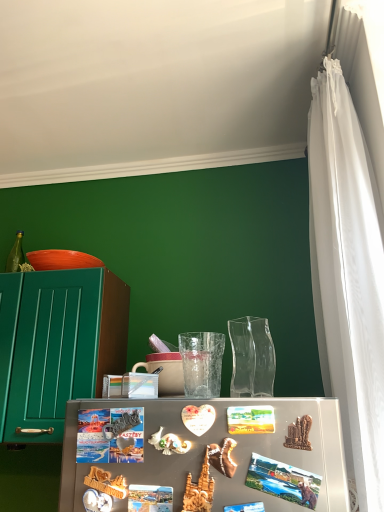
Question: From the image's perspective, would you say matte ceramic mug at center is shown under transparent glass vase at center?

Choices:
 (A) yes
 (B) no

Answer: (A)

Question: Is transparent glass vase at center inside matte ceramic mug at center?

Choices:
 (A) yes
 (B) no

Answer: (B)

Question: Can you confirm if matte ceramic mug at center is taller than transparent glass vase at center?

Choices:
 (A) yes
 (B) no

Answer: (A)

Question: Considering the relative sizes of matte ceramic mug at center and transparent glass vase at center in the image provided, is matte ceramic mug at center bigger than transparent glass vase at center?

Choices:
 (A) yes
 (B) no

Answer: (A)

Question: Is matte ceramic mug at center far away from transparent glass vase at center?

Choices:
 (A) no
 (B) yes

Answer: (A)

Question: Is transparent glass vase at center in front of or behind orange matte bowl at upper left in the image?

Choices:
 (A) front
 (B) behind

Answer: (A)

Question: Does point (266, 361) appear closer or farther from the camera than point (57, 258)?

Choices:
 (A) closer
 (B) farther

Answer: (A)

Question: From a real-world perspective, is transparent glass vase at center physically located above or below orange matte bowl at upper left?

Choices:
 (A) above
 (B) below

Answer: (B)

Question: Considering the relative positions of transparent glass vase at center and orange matte bowl at upper left in the image provided, is transparent glass vase at center to the left or to the right of orange matte bowl at upper left?

Choices:
 (A) left
 (B) right

Answer: (B)

Question: Is orange matte bowl at upper left spatially inside transparent textured glass at center, or outside of it?

Choices:
 (A) outside
 (B) inside

Answer: (A)

Question: Is orange matte bowl at upper left wider or thinner than transparent textured glass at center?

Choices:
 (A) thin
 (B) wide

Answer: (B)

Question: Is orange matte bowl at upper left in front of or behind transparent textured glass at center in the image?

Choices:
 (A) behind
 (B) front

Answer: (A)

Question: Considering the positions of orange matte bowl at upper left and transparent textured glass at center in the image, is orange matte bowl at upper left taller or shorter than transparent textured glass at center?

Choices:
 (A) short
 (B) tall

Answer: (A)

Question: Is point (299, 480) positioned closer to the camera than point (168, 382)?

Choices:
 (A) farther
 (B) closer

Answer: (B)

Question: In terms of height, does metallic photo magnet at center look taller or shorter compared to matte ceramic mug at center?

Choices:
 (A) short
 (B) tall

Answer: (A)